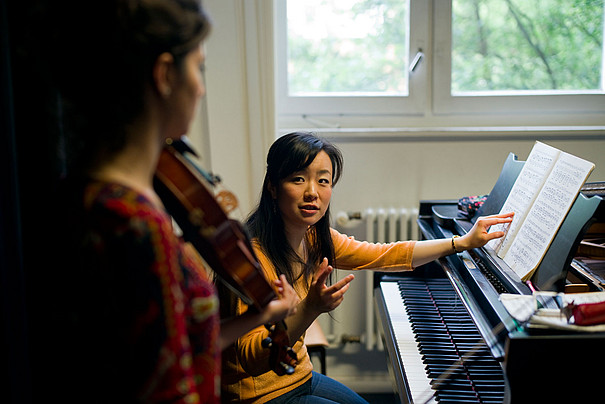
Find the location of a particular element. radiator is located at coordinates (390, 216).